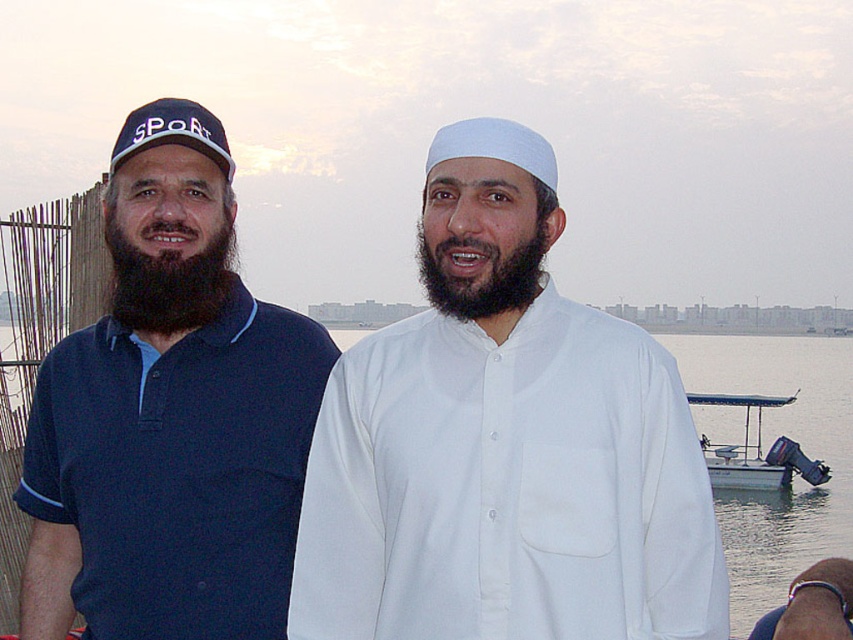
Who is positioned more to the left, white matte shirt at center or dark brown fuzzy beard at left?

dark brown fuzzy beard at left

Who is more distant from viewer, (x=389, y=476) or (x=158, y=269)?

Positioned behind is point (x=389, y=476).

Find the location of `white matte shirt at center`. white matte shirt at center is located at coordinates (503, 444).

Who is positioned more to the right, dark brown matte beard at center or matte blue baseball cap at left?

dark brown matte beard at center is more to the right.

Can you confirm if dark brown matte beard at center is shorter than matte blue baseball cap at left?

Indeed, dark brown matte beard at center has a lesser height compared to matte blue baseball cap at left.

Is point (462, 308) in front of point (169, 129)?

No.

The image size is (853, 640). What are the coordinates of `dark brown matte beard at center` in the screenshot? It's located at (486, 276).

Can you confirm if matte blue polo shirt at left is wider than dark brown matte beard at center?

No, matte blue polo shirt at left is not wider than dark brown matte beard at center.

Can you confirm if matte blue polo shirt at left is positioned to the left of dark brown matte beard at center?

Indeed, matte blue polo shirt at left is positioned on the left side of dark brown matte beard at center.

Where is `matte blue polo shirt at left`? This screenshot has height=640, width=853. matte blue polo shirt at left is located at coordinates (170, 416).